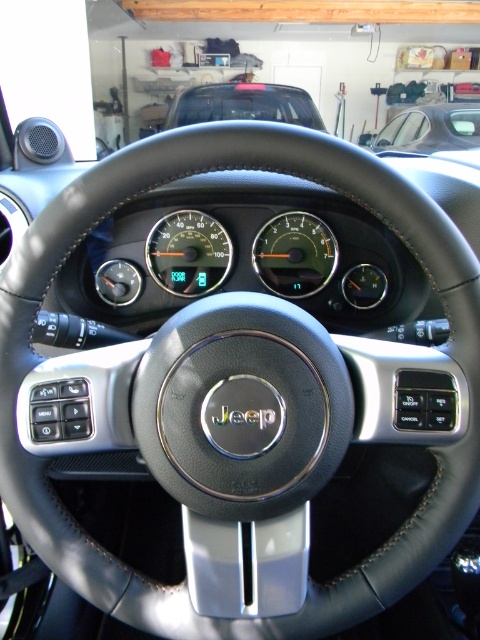
You are driving a matte black car at upper center and want to overtake the metallic silver car at upper right. Can you safely pass them based on their current positions?

The matte black car at upper center is in front of the metallic silver car at upper right, so it is already ahead of them. To overtake, you would need to be behind, so you cannot safely pass them in this position.

You are a mechanic working on a Jeep vehicle and need to install a new control panel between the matte black speedometer at center and the matte black gauge at center. The control panel requires a minimum of 6 inches of space. Based on the image, will there be enough space for the control panel?

The distance between the matte black speedometer at center and the matte black gauge at center is 5.75 inches, which is less than the required 6 inches. Therefore, there will not be enough space for the control panel.

You are sitting in the driver seat of the vehicle and looking at the dashboard. Which object is located higher up between the matte black speedometer at center and the matte black car at upper center?

The matte black car at upper center is located higher up than the matte black speedometer at center.